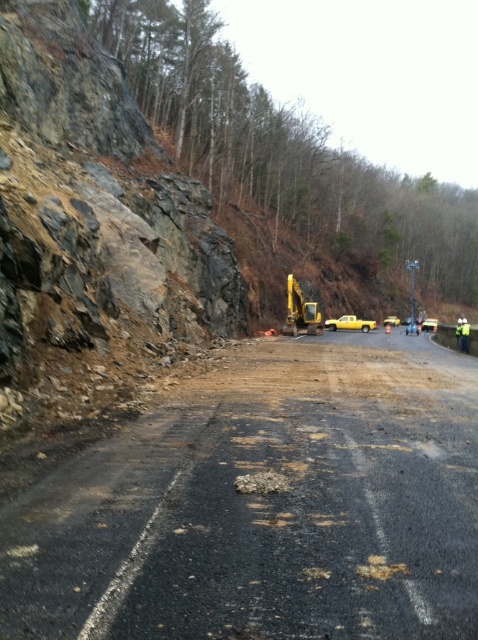
Can you confirm if asphalt road at center is positioned to the right of yellow rubber excavator at center?

Incorrect, asphalt road at center is not on the right side of yellow rubber excavator at center.

Does point (462, 445) lie in front of point (291, 276)?

Yes, point (462, 445) is in front of point (291, 276).

Is point (269, 465) closer to camera compared to point (297, 305)?

Yes, it is.

Locate an element on the screen. The image size is (478, 640). asphalt road at center is located at coordinates (265, 506).